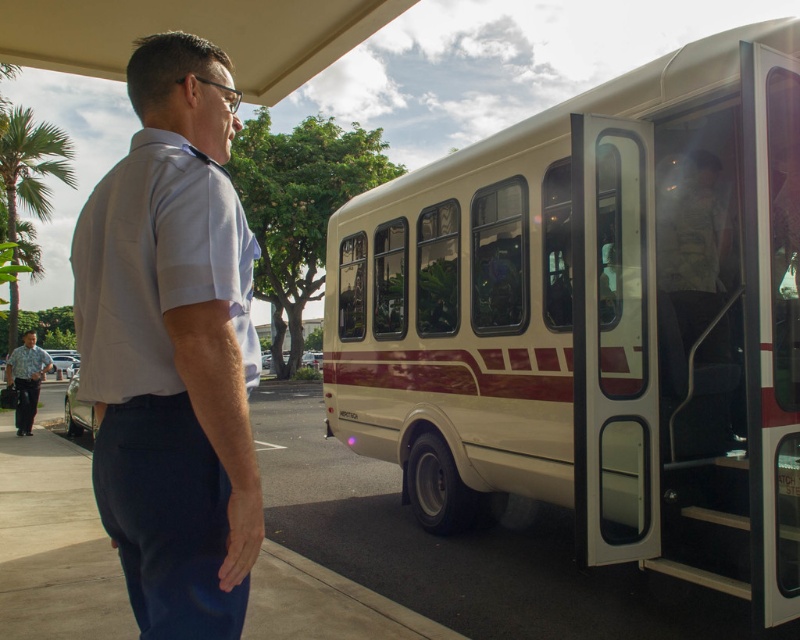
Describe the element at coordinates (596, 317) in the screenshot. This screenshot has width=800, height=640. I see `beige/wooden bus at right` at that location.

Consider the image. Is beige/wooden bus at right positioned before green leafy palm tree at upper left?

Yes, beige/wooden bus at right is closer to the viewer.

Is point (605, 387) closer to viewer compared to point (58, 172)?

Yes, it is in front of point (58, 172).

Where is `beige/wooden bus at right`? beige/wooden bus at right is located at coordinates (596, 317).

Does light blue shirt at center have a greater height compared to clear glass door at center?

No.

Which is more to the right, light blue shirt at center or clear glass door at center?

clear glass door at center is more to the right.

The height and width of the screenshot is (640, 800). Describe the element at coordinates (172, 348) in the screenshot. I see `light blue shirt at center` at that location.

Image resolution: width=800 pixels, height=640 pixels. I want to click on light blue shirt at center, so click(x=172, y=348).

Is the position of beige/wooden bus at right less distant than that of clear glass door at center?

Yes, it is in front of clear glass door at center.

Where is `beige/wooden bus at right`? The width and height of the screenshot is (800, 640). beige/wooden bus at right is located at coordinates (596, 317).